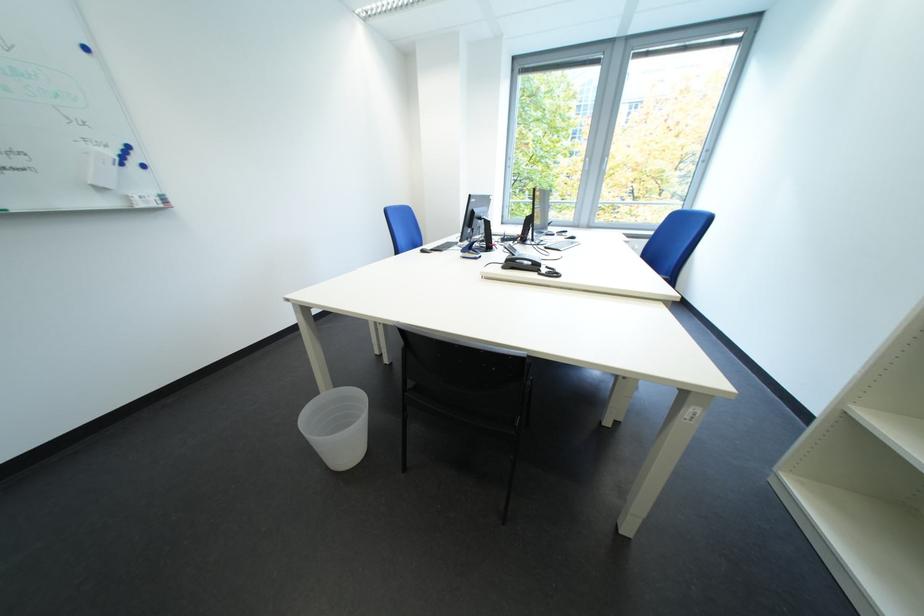
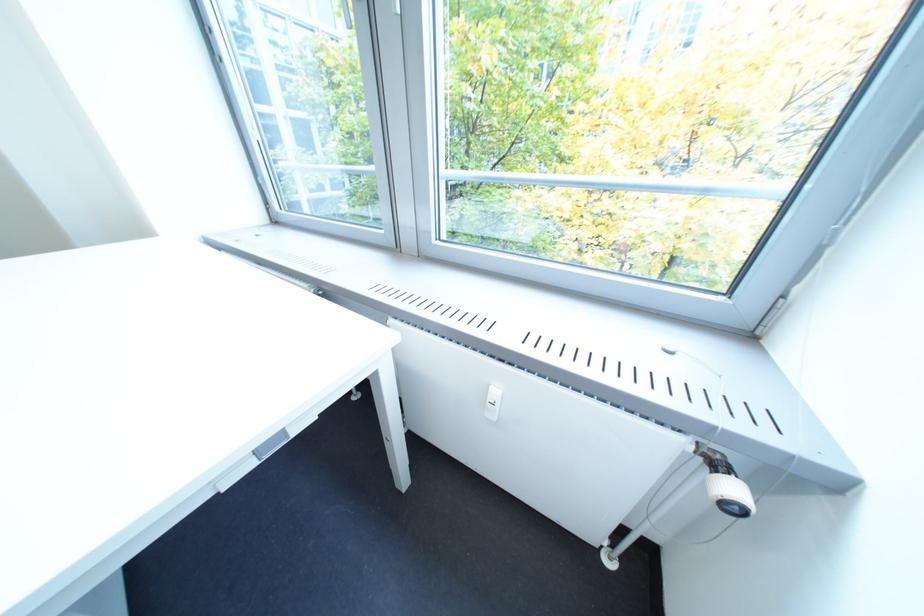
The images are taken continuously from a first-person perspective. In which direction are you moving?

The movement direction of the cameraman is right, forward.